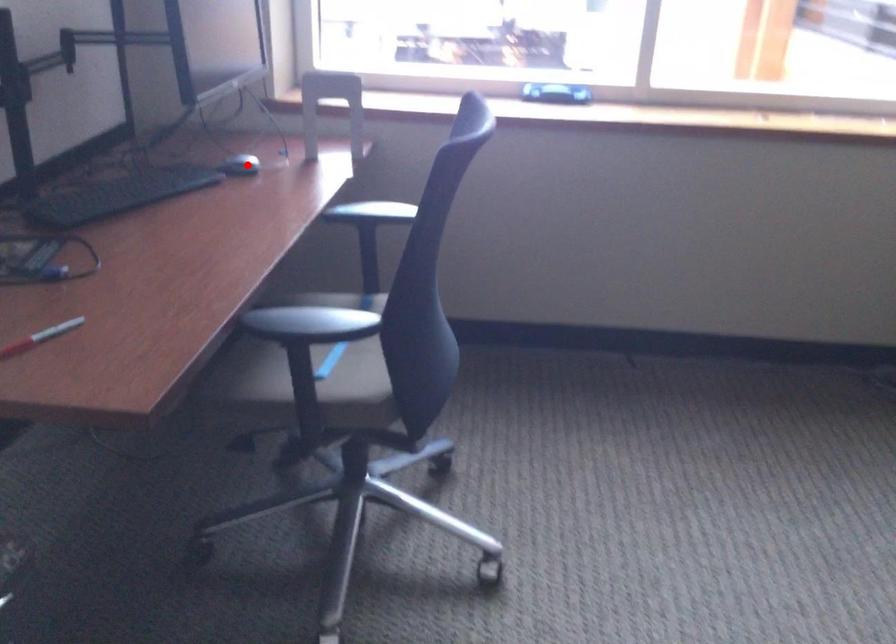
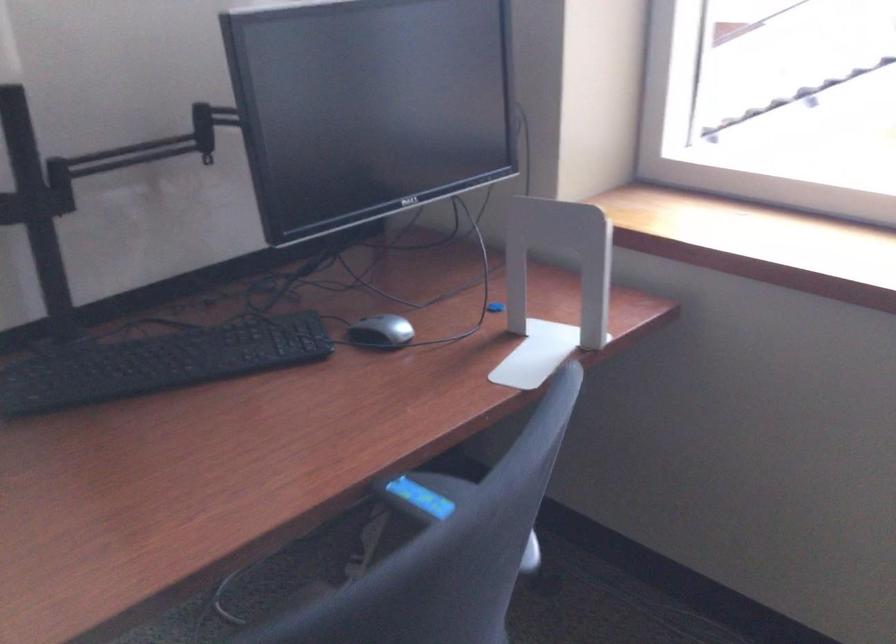
Question: I am providing you with two images of the same scene from different viewpoints. Given a red point in image1, look at the same physical point in image2. Is it:

Choices:
 (A) Closer to the viewpoint
 (B) Farther from the viewpoint

Answer: (A)